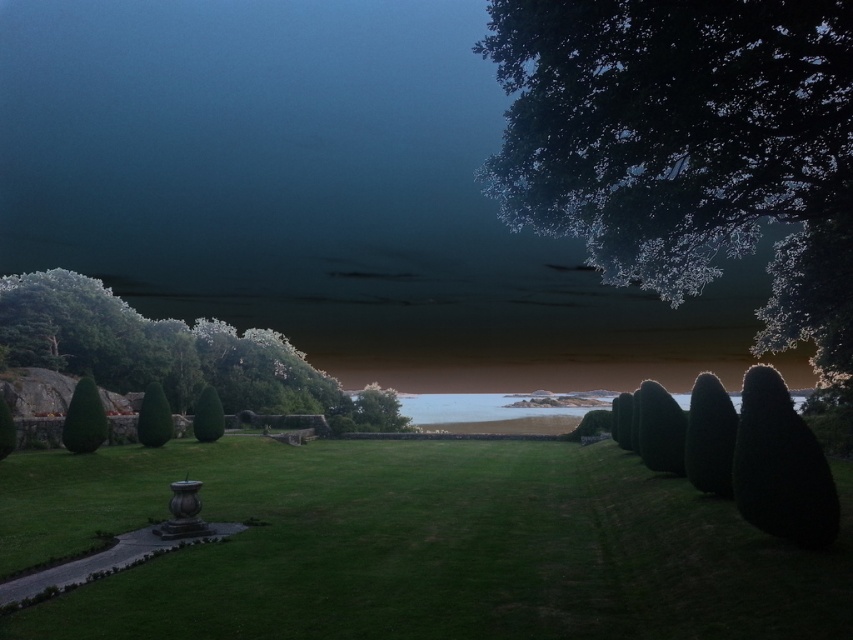
Is point (161, 388) positioned behind point (213, 396)?

No, it is not.

Identify the location of green textured hedge at lower left. (154, 417).

Consider the image. Is green leafy tree at upper right taller than green leafy tree at lower left?

Yes, green leafy tree at upper right is taller than green leafy tree at lower left.

Is green leafy tree at upper right positioned at the back of green leafy tree at lower left?

No, it is in front of green leafy tree at lower left.

Find the location of a particular element. Image resolution: width=853 pixels, height=640 pixels. green leafy tree at upper right is located at coordinates (688, 147).

Looking at this image, measure the distance between green leafy tree at lower left and camera.

31.71 meters

Which of these two, green leafy tree at lower left or green leafy bush at center, stands taller?

Standing taller between the two is green leafy bush at center.

Locate an element on the screen. The width and height of the screenshot is (853, 640). green leafy tree at lower left is located at coordinates (84, 419).